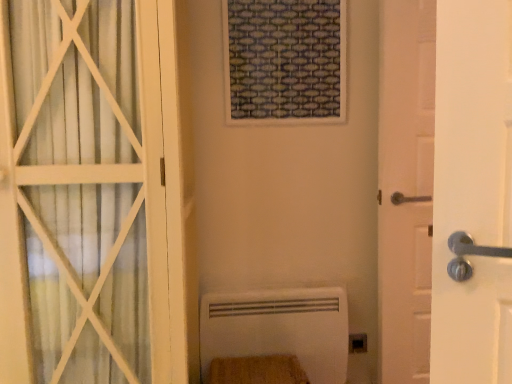
Where is `black plastic electric outlet at lower right`? black plastic electric outlet at lower right is located at coordinates (358, 343).

The height and width of the screenshot is (384, 512). In order to click on wooden textured window frame at upper center in this screenshot , I will do `click(285, 61)`.

This screenshot has height=384, width=512. What do you see at coordinates (279, 328) in the screenshot?
I see `white matte radiator at lower center` at bounding box center [279, 328].

The width and height of the screenshot is (512, 384). Find the location of `black plastic electric outlet at lower right`. black plastic electric outlet at lower right is located at coordinates (358, 343).

Which is less distant, (419, 277) or (258, 324)?

Point (419, 277) is positioned closer to the camera compared to point (258, 324).

Based on the photo, considering their positions, is white wooden door at right, which ranks as the 2th door in left-to-right order, located in front of or behind white matte radiator at lower center?

white wooden door at right, which ranks as the 2th door in left-to-right order, is in front of white matte radiator at lower center.

Is white matte radiator at lower center surrounded by white wooden door at right, the 1th door viewed from the right?

No, white matte radiator at lower center is not inside white wooden door at right, the 1th door viewed from the right.

Locate an element on the screen. Image resolution: width=512 pixels, height=384 pixels. window frame located above the white wooden door at right, the 1th door viewed from the right (from a real-world perspective) is located at coordinates (285, 61).

Who is shorter, wooden textured window frame at upper center or white wooden door at right, which ranks as the 2th door in left-to-right order?

wooden textured window frame at upper center is shorter.

From the picture: Looking at their sizes, would you say wooden textured window frame at upper center is wider or thinner than white wooden door at right, which ranks as the 2th door in left-to-right order?

Clearly, wooden textured window frame at upper center has less width compared to white wooden door at right, which ranks as the 2th door in left-to-right order.

From a real-world perspective, is wooden textured window frame at upper center over white wooden door at right, which ranks as the 2th door in left-to-right order?

Yes.

Is white wooden door at right, which ranks as the 2th door in left-to-right order, looking in the opposite direction of wooden textured window frame at upper center?

No, wooden textured window frame at upper center is not at the back of white wooden door at right, which ranks as the 2th door in left-to-right order.

Does point (384, 51) come closer to viewer compared to point (241, 80)?

That is True.

Does white wooden door at right, the 1th door viewed from the right, lie in front of wooden textured window frame at upper center?

Yes.

Considering the sizes of objects white wooden door at right, which ranks as the 2th door in left-to-right order, and wooden textured window frame at upper center in the image provided, who is smaller, white wooden door at right, which ranks as the 2th door in left-to-right order, or wooden textured window frame at upper center?

wooden textured window frame at upper center is smaller.

Is black plastic electric outlet at lower right placed right next to wooden textured window frame at upper center?

black plastic electric outlet at lower right and wooden textured window frame at upper center are not in contact.

Is black plastic electric outlet at lower right oriented towards wooden textured window frame at upper center?

No, black plastic electric outlet at lower right is not oriented towards wooden textured window frame at upper center.

From the image's perspective, which is above, black plastic electric outlet at lower right or wooden textured window frame at upper center?

wooden textured window frame at upper center, from the image's perspective.

Is black plastic electric outlet at lower right situated inside wooden textured window frame at upper center or outside?

black plastic electric outlet at lower right is spatially situated outside wooden textured window frame at upper center.

From the picture: Is white matte radiator at lower center with black plastic electric outlet at lower right?

No, white matte radiator at lower center is not touching black plastic electric outlet at lower right.

From their relative heights in the image, would you say white matte radiator at lower center is taller or shorter than black plastic electric outlet at lower right?

white matte radiator at lower center is taller than black plastic electric outlet at lower right.

Identify the location of radiator above the black plastic electric outlet at lower right (from a real-world perspective). (279, 328).

Considering the sizes of white matte door at left, which is the 1th door from left to right, and white wooden door at right, the 1th door viewed from the right, in the image, is white matte door at left, which is the 1th door from left to right, wider or thinner than white wooden door at right, the 1th door viewed from the right,?

white matte door at left, which is the 1th door from left to right, is wider than white wooden door at right, the 1th door viewed from the right.

Is white matte door at left, which ranks as the 2th door in right-to-left order, shorter than white wooden door at right, which ranks as the 2th door in left-to-right order?

Correct, white matte door at left, which ranks as the 2th door in right-to-left order, is not as tall as white wooden door at right, which ranks as the 2th door in left-to-right order.

Does white matte door at left, which is the 1th door from left to right, come behind white wooden door at right, the 1th door viewed from the right?

No, white matte door at left, which is the 1th door from left to right, is closer to the camera.

From the image's perspective, does white matte door at left, which is the 1th door from left to right, appear lower than white wooden door at right, which ranks as the 2th door in left-to-right order?

Indeed, from the image's perspective, white matte door at left, which is the 1th door from left to right, is shown beneath white wooden door at right, which ranks as the 2th door in left-to-right order.

Considering the relative positions of white matte radiator at lower center and white matte door at left, which ranks as the 2th door in right-to-left order, in the image provided, is white matte radiator at lower center to the right of white matte door at left, which ranks as the 2th door in right-to-left order, from the viewer's perspective?

Indeed, white matte radiator at lower center is positioned on the right side of white matte door at left, which ranks as the 2th door in right-to-left order.

From the image's perspective, relative to white matte door at left, which is the 1th door from left to right, is white matte radiator at lower center above or below?

white matte radiator at lower center is below white matte door at left, which is the 1th door from left to right.

Consider the image. Is white matte radiator at lower center inside the boundaries of white matte door at left, which ranks as the 2th door in right-to-left order, or outside?

white matte radiator at lower center is located beyond the bounds of white matte door at left, which ranks as the 2th door in right-to-left order.

At what (x,y) coordinates should I click in order to perform the action: click on radiator directly beneath the white wooden door at right, the 1th door viewed from the right (from a real-world perspective). Please return your answer as a coordinate pair (x, y). This screenshot has width=512, height=384. Looking at the image, I should click on (279, 328).

Find the location of a particular element. window frame above the white wooden door at right, which ranks as the 2th door in left-to-right order (from a real-world perspective) is located at coordinates (285, 61).

When comparing their distances from white wooden door at right, which ranks as the 2th door in left-to-right order, does white matte door at left, which ranks as the 2th door in right-to-left order, or white matte radiator at lower center seem closer?

The object closer to white wooden door at right, which ranks as the 2th door in left-to-right order, is white matte radiator at lower center.

Looking at the image, which one is located closer to black plastic electric outlet at lower right, wooden textured window frame at upper center or white matte radiator at lower center?

white matte radiator at lower center lies closer to black plastic electric outlet at lower right than the other object.

In the scene shown: Looking at the image, which one is located closer to black plastic electric outlet at lower right, white matte radiator at lower center or wooden textured window frame at upper center?

Based on the image, white matte radiator at lower center appears to be nearer to black plastic electric outlet at lower right.

Looking at the image, which one is located closer to wooden textured window frame at upper center, white matte door at left, which ranks as the 2th door in right-to-left order, or black plastic electric outlet at lower right?

Among the two, white matte door at left, which ranks as the 2th door in right-to-left order, is located nearer to wooden textured window frame at upper center.

Estimate the real-world distances between objects in this image. Which object is further from white matte radiator at lower center, white wooden door at right, which ranks as the 2th door in left-to-right order, or wooden textured window frame at upper center?

wooden textured window frame at upper center is further to white matte radiator at lower center.

Considering their positions, is white matte radiator at lower center positioned closer to black plastic electric outlet at lower right than white wooden door at right, the 1th door viewed from the right?

white matte radiator at lower center.

Which object lies further to the anchor point white matte door at left, which ranks as the 2th door in right-to-left order, white matte radiator at lower center or white wooden door at right, which ranks as the 2th door in left-to-right order?

white wooden door at right, which ranks as the 2th door in left-to-right order, is further to white matte door at left, which ranks as the 2th door in right-to-left order.

Estimate the real-world distances between objects in this image. Which object is closer to white wooden door at right, which ranks as the 2th door in left-to-right order, black plastic electric outlet at lower right or white matte door at left, which ranks as the 2th door in right-to-left order?

black plastic electric outlet at lower right is closer to white wooden door at right, which ranks as the 2th door in left-to-right order.

I want to click on radiator located between white matte door at left, which ranks as the 2th door in right-to-left order, and black plastic electric outlet at lower right in the left-right direction, so click(x=279, y=328).

The width and height of the screenshot is (512, 384). Identify the location of radiator between white matte door at left, which ranks as the 2th door in right-to-left order, and white wooden door at right, which ranks as the 2th door in left-to-right order. pyautogui.click(x=279, y=328).

Where is `electric outlet situated between white matte door at left, which is the 1th door from left to right, and white wooden door at right, the 1th door viewed from the right, from left to right`? electric outlet situated between white matte door at left, which is the 1th door from left to right, and white wooden door at right, the 1th door viewed from the right, from left to right is located at coordinates (358, 343).

Identify the location of window frame located between white matte door at left, which is the 1th door from left to right, and white wooden door at right, the 1th door viewed from the right, in the left-right direction. The image size is (512, 384). click(285, 61).